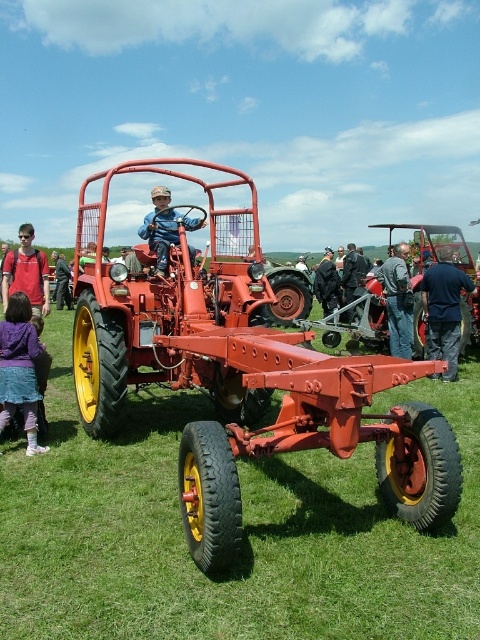
Question: Among these objects, which one is nearest to the camera?

Choices:
 (A) dark blue jacket at center
 (B) dark blue shirt at center
 (C) matte red shirt at left
 (D) matte red tractor at center

Answer: (D)

Question: Can you confirm if matte red tractor at center is bigger than purple fabric dress at lower left?

Choices:
 (A) yes
 (B) no

Answer: (A)

Question: Which point is farther to the camera?

Choices:
 (A) (349, 320)
 (B) (429, 493)
 (C) (456, 348)

Answer: (A)

Question: Is the position of matte red tractor at center more distant than that of dark blue shirt at center?

Choices:
 (A) yes
 (B) no

Answer: (B)

Question: Which point is closer to the camera taking this photo?

Choices:
 (A) (454, 360)
 (B) (9, 276)
 (C) (23, 392)
 (D) (347, 275)

Answer: (C)

Question: Does matte red tractor at center have a smaller size compared to matte red shirt at left?

Choices:
 (A) no
 (B) yes

Answer: (B)